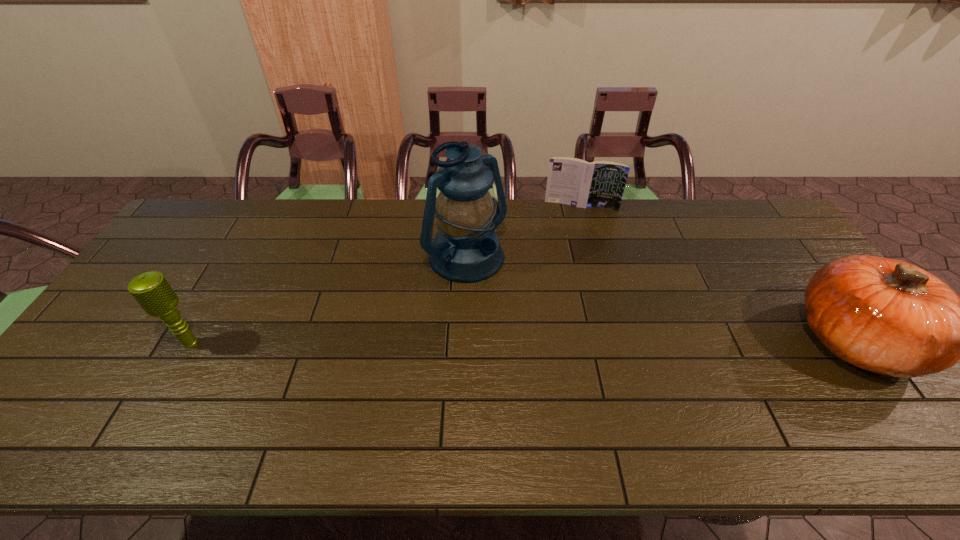
This screenshot has height=540, width=960. I want to click on free space located on the front cover of the farthest object, so pos(570,254).

This screenshot has height=540, width=960. In order to click on blank space located on the front cover of the farthest object in this screenshot , I will do `click(569, 260)`.

Identify the location of lantern that is at the far edge. (466, 249).

The image size is (960, 540). Identify the location of book that is at the far edge. (600, 184).

You are a GUI agent. You are given a task and a screenshot of the screen. Output one action in this format:
    pyautogui.click(x=<x>, y=<y>)
    Task: Click on the vacant space at the far edge of the desktop
    The height and width of the screenshot is (540, 960).
    Given the screenshot: What is the action you would take?
    pyautogui.click(x=552, y=207)

At what (x,y) coordinates should I click in order to perform the action: click on free space at the near edge of the desktop. Please return your answer as a coordinate pair (x, y). The height and width of the screenshot is (540, 960). Looking at the image, I should click on (132, 390).

Locate an element on the screen. free space at the left edge of the desktop is located at coordinates (130, 348).

Locate an element on the screen. The image size is (960, 540). free point at the near right corner is located at coordinates (895, 401).

Where is `empty space between the microphone and the lantern`? The height and width of the screenshot is (540, 960). empty space between the microphone and the lantern is located at coordinates (329, 302).

Identify the location of empty location between the leftmost object and the tallest object. (329, 302).